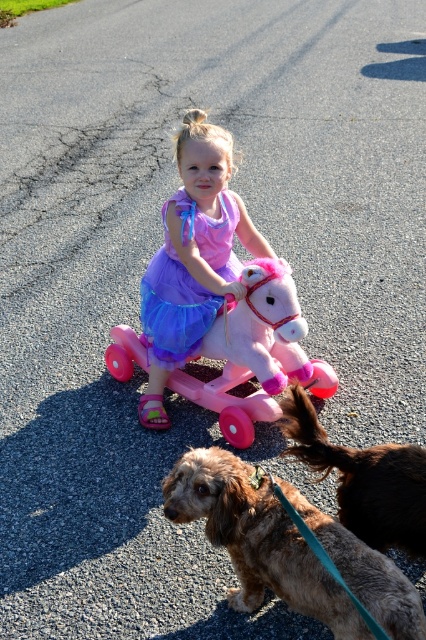
Measure the distance between pink satin dress at center and camera.

pink satin dress at center and camera are 3.10 meters apart.

Can you confirm if pink satin dress at center is wider than pastel pink plastic horse at center?

In fact, pink satin dress at center might be narrower than pastel pink plastic horse at center.

Locate an element on the screen. pink satin dress at center is located at coordinates (192, 257).

Is point (270, 577) in front of point (229, 440)?

Yes.

Does point (299, 552) come farther from viewer compared to point (131, 360)?

No, (299, 552) is in front of (131, 360).

The height and width of the screenshot is (640, 426). In order to click on brown fuzzy dog at lower center in this screenshot , I will do `click(256, 540)`.

Can you confirm if brown furry dog at lower right is taller than purple satin dress at center?

Incorrect, brown furry dog at lower right's height is not larger of purple satin dress at center's.

The image size is (426, 640). Identify the location of brown furry dog at lower right. (363, 480).

Locate an element on the screen. The height and width of the screenshot is (640, 426). brown furry dog at lower right is located at coordinates (x=363, y=480).